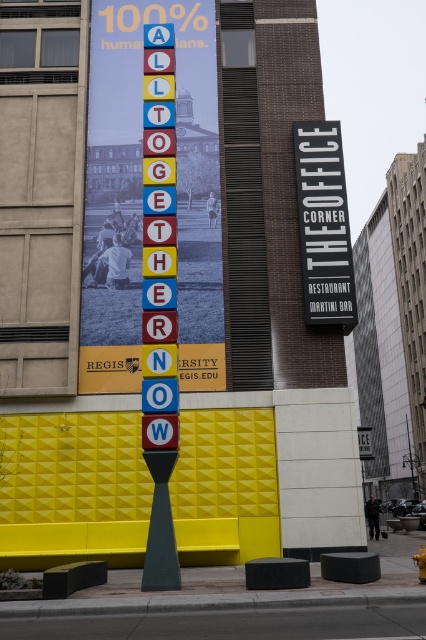
Is metallic signboard at center bigger than black plastic sign at upper right?

Correct, metallic signboard at center is larger in size than black plastic sign at upper right.

Is point (204, 208) more distant than point (337, 304)?

Yes, point (204, 208) is behind point (337, 304).

At what (x,y) coordinates should I click in order to perform the action: click on metallic signboard at center. Please return your answer as a coordinate pair (x, y). This screenshot has height=640, width=426. Looking at the image, I should click on click(x=152, y=195).

This screenshot has height=640, width=426. What are the coordinates of `metallic signboard at center` in the screenshot? It's located at (152, 195).